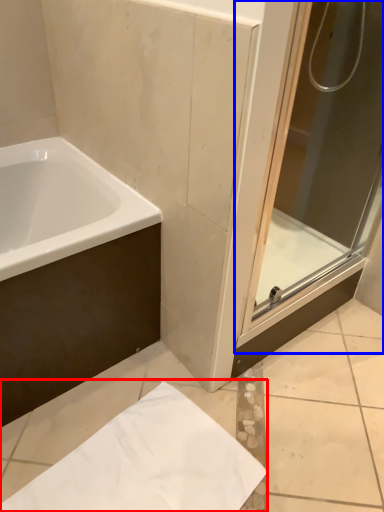
Question: Which point is closer to the camera, paper (highlighted by a red box) or screen door (highlighted by a blue box)?

Choices:
 (A) paper
 (B) screen door

Answer: (B)